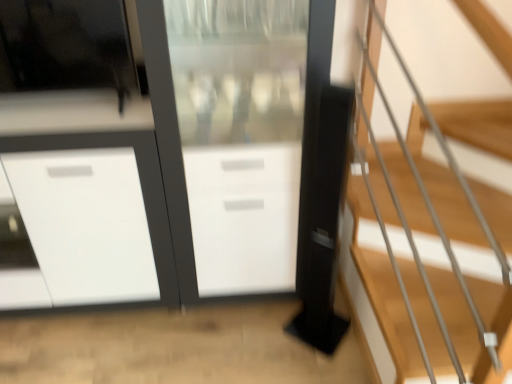
Question: From the image's perspective, is wooden stairs at right on top of transparent glass screen door at center?

Choices:
 (A) no
 (B) yes

Answer: (A)

Question: From the image's perspective, does wooden stairs at right appear lower than transparent glass screen door at center?

Choices:
 (A) yes
 (B) no

Answer: (A)

Question: From a real-world perspective, is wooden stairs at right positioned over transparent glass screen door at center based on gravity?

Choices:
 (A) yes
 (B) no

Answer: (A)

Question: Considering the relative sizes of wooden stairs at right and transparent glass screen door at center in the image provided, is wooden stairs at right smaller than transparent glass screen door at center?

Choices:
 (A) yes
 (B) no

Answer: (A)

Question: From a real-world perspective, is wooden stairs at right located beneath transparent glass screen door at center?

Choices:
 (A) no
 (B) yes

Answer: (A)

Question: Looking at their shapes, would you say transparent glass screen door at center is wider or thinner than wooden stairs at right?

Choices:
 (A) wide
 (B) thin

Answer: (B)

Question: Considering their positions, is transparent glass screen door at center located in front of or behind wooden stairs at right?

Choices:
 (A) behind
 (B) front

Answer: (A)

Question: From the image's perspective, is transparent glass screen door at center positioned above or below wooden stairs at right?

Choices:
 (A) below
 (B) above

Answer: (B)

Question: Does point (196, 168) appear closer or farther from the camera than point (454, 134)?

Choices:
 (A) closer
 (B) farther

Answer: (A)

Question: Is wooden stairs at right taller or shorter than white glossy cabinet at center?

Choices:
 (A) short
 (B) tall

Answer: (B)

Question: Based on their sizes in the image, would you say wooden stairs at right is bigger or smaller than white glossy cabinet at center?

Choices:
 (A) big
 (B) small

Answer: (B)

Question: From a real-world perspective, is wooden stairs at right above or below white glossy cabinet at center?

Choices:
 (A) above
 (B) below

Answer: (A)

Question: Considering the positions of wooden stairs at right and white glossy cabinet at center in the image, is wooden stairs at right wider or thinner than white glossy cabinet at center?

Choices:
 (A) wide
 (B) thin

Answer: (A)

Question: Considering the positions of white glossy cabinet at center and transparent glass screen door at center in the image, is white glossy cabinet at center wider or thinner than transparent glass screen door at center?

Choices:
 (A) wide
 (B) thin

Answer: (A)

Question: From the image's perspective, relative to transparent glass screen door at center, is white glossy cabinet at center above or below?

Choices:
 (A) above
 (B) below

Answer: (B)